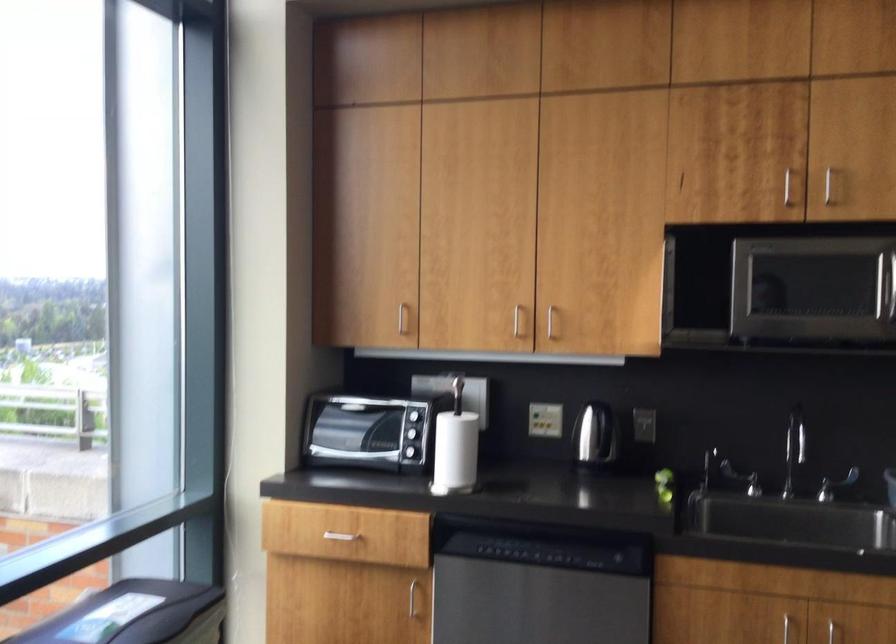
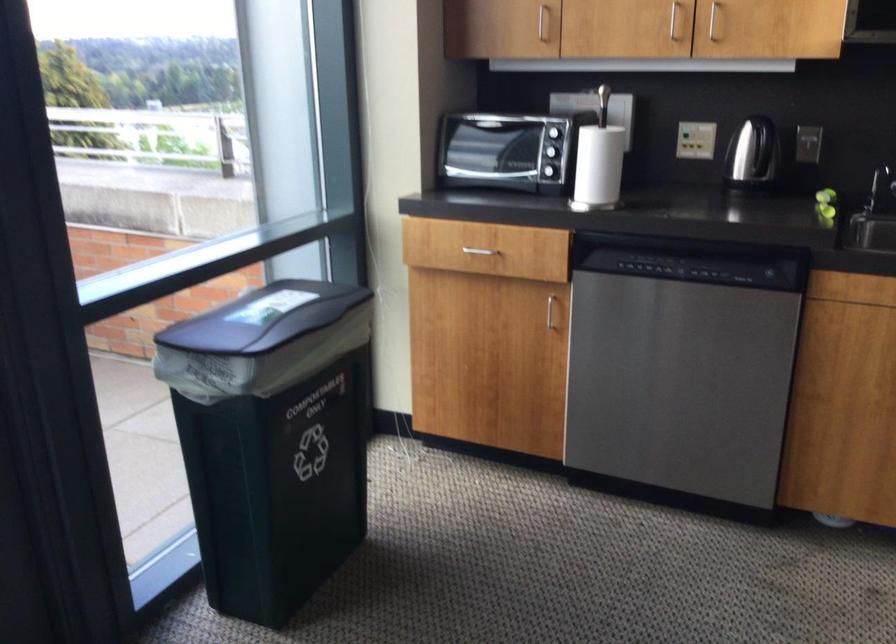
Where in the second image is the point corresponding to [409,317] from the first image?

(543, 23)